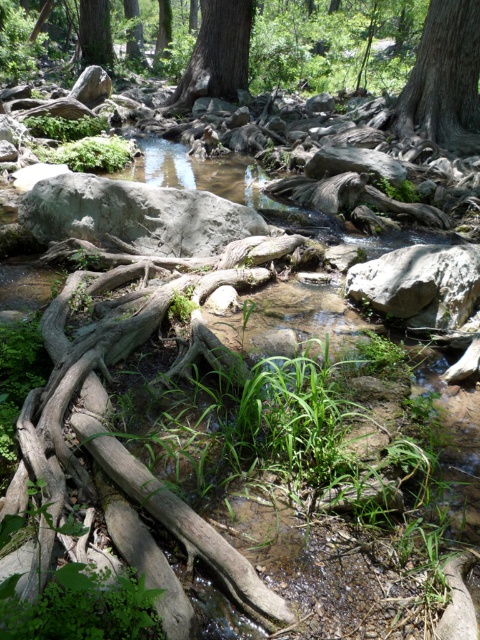
You are standing at the edge of the stream and notice a point marked at coordinates (444,80). Based on the scene description, what feature is located at that point?

The point at coordinates (444,80) indicates smooth gray bark at upper right.